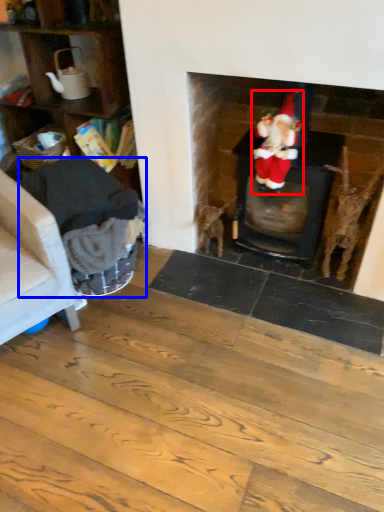
Question: Which point is further to the camera, person (highlighted by a red box) or armchair (highlighted by a blue box)?

Choices:
 (A) person
 (B) armchair

Answer: (A)